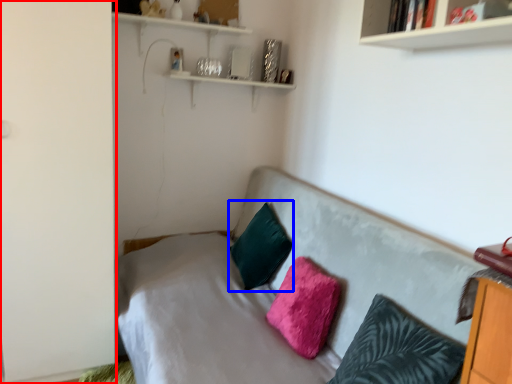
Question: Which point is further to the camera, side (highlighted by a red box) or pillow (highlighted by a blue box)?

Choices:
 (A) side
 (B) pillow

Answer: (B)